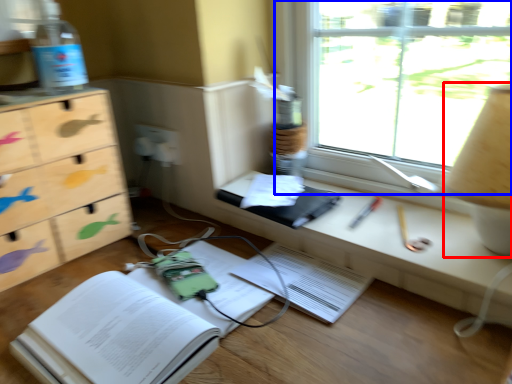
Question: Which of the following is the closest to the observer, table lamp (highlighted by a red box) or window (highlighted by a blue box)?

Choices:
 (A) table lamp
 (B) window

Answer: (A)